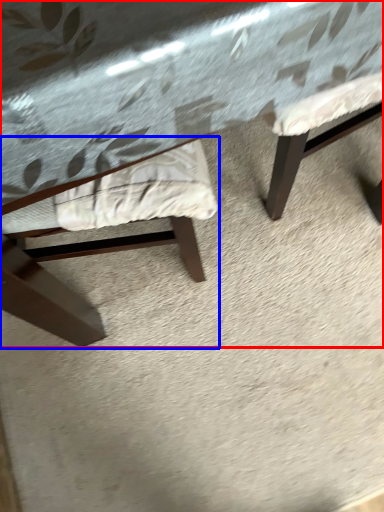
Question: Among these objects, which one is nearest to the camera, table (highlighted by a red box) or chair (highlighted by a blue box)?

Choices:
 (A) table
 (B) chair

Answer: (A)